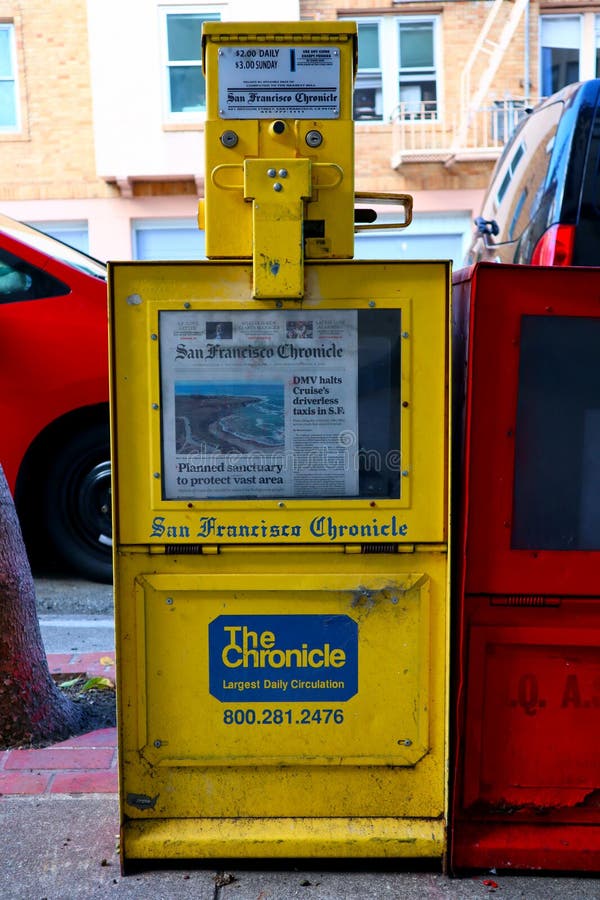
The width and height of the screenshot is (600, 900). I want to click on window, so click(x=183, y=27), click(x=372, y=51), click(x=410, y=50), click(x=560, y=55), click(x=9, y=57), click(x=163, y=241), click(x=74, y=231).